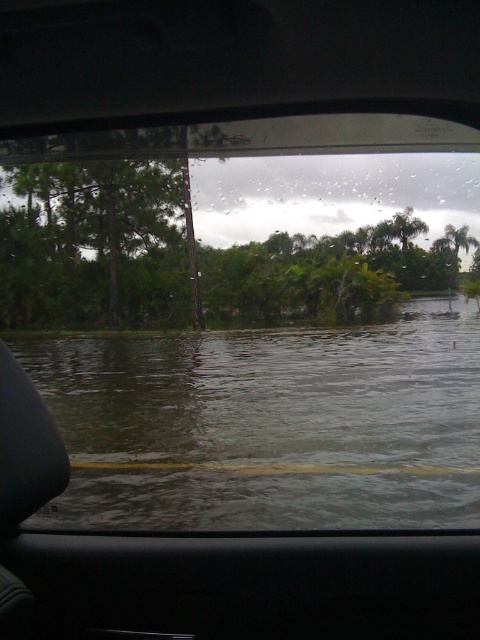
Question: Which is nearer to the clear water at lower center?

Choices:
 (A) green leafy tree at center
 (B) green leafy tree at left

Answer: (A)

Question: Which point is farther to the camera?

Choices:
 (A) (132, 378)
 (B) (127, 225)

Answer: (B)

Question: Which point is farther to the camera?

Choices:
 (A) clear water at lower center
 (B) green leafy tree at center
 (C) green leafy tree at left

Answer: (C)

Question: Where is clear water at lower center located in relation to green leafy tree at center in the image?

Choices:
 (A) below
 (B) above

Answer: (A)

Question: Is green leafy tree at center wider than green leafy tree at left?

Choices:
 (A) no
 (B) yes

Answer: (B)

Question: Where is clear water at lower center located in relation to green leafy tree at center in the image?

Choices:
 (A) right
 (B) left

Answer: (A)